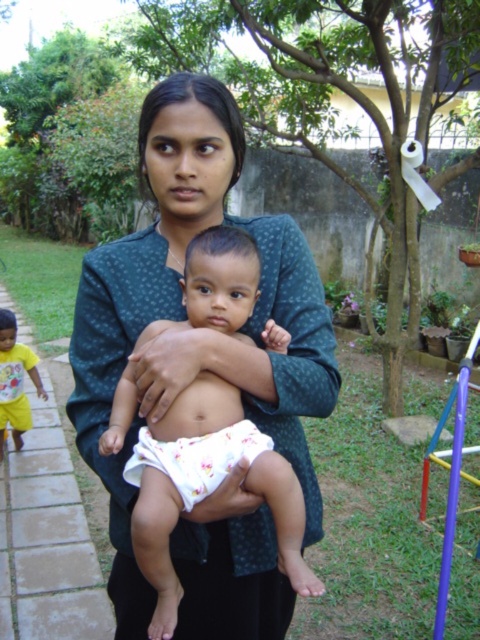
Locate an element on the screen. The height and width of the screenshot is (640, 480). white clothed baby at center is located at coordinates (206, 486).

Does white clothed baby at center appear over floral cotton diaper at center?

Yes.

Does point (149, 548) lie behind point (196, 452)?

That is False.

Find the location of `white clothed baby at center`. white clothed baby at center is located at coordinates (206, 486).

Does white clothed baby at center have a lesser width compared to yellow cotton shirt at left?

No.

Is white clothed baby at center closer to camera compared to yellow cotton shirt at left?

Yes, it is in front of yellow cotton shirt at left.

Does point (211, 253) come farther from viewer compared to point (9, 368)?

No.

Where is `white clothed baby at center`? This screenshot has height=640, width=480. white clothed baby at center is located at coordinates (206, 486).

Does floral cotton diaper at center have a greater height compared to yellow cotton shirt at left?

Incorrect, floral cotton diaper at center's height is not larger of yellow cotton shirt at left's.

Based on the photo, who is shorter, floral cotton diaper at center or yellow cotton shirt at left?

floral cotton diaper at center

You are a GUI agent. You are given a task and a screenshot of the screen. Output one action in this format:
    pyautogui.click(x=<x>, y=<y>)
    Task: Click on the floral cotton diaper at center
    
    Given the screenshot: What is the action you would take?
    pyautogui.click(x=196, y=458)